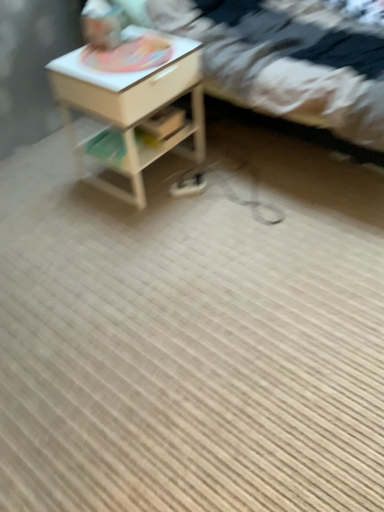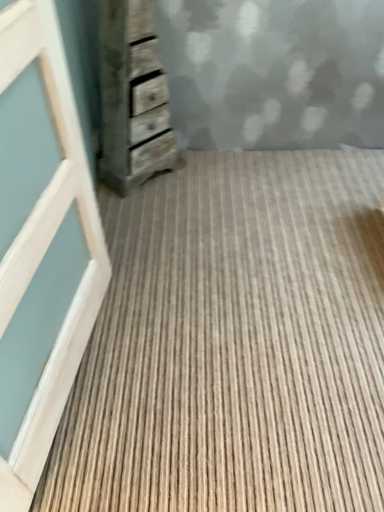
Question: Which way did the camera rotate in the video?

Choices:
 (A) rotated left
 (B) rotated right

Answer: (A)